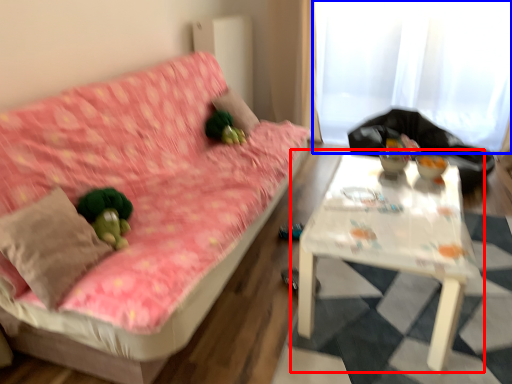
Question: Which object is closer to the camera taking this photo, table (highlighted by a red box) or curtain (highlighted by a blue box)?

Choices:
 (A) table
 (B) curtain

Answer: (A)